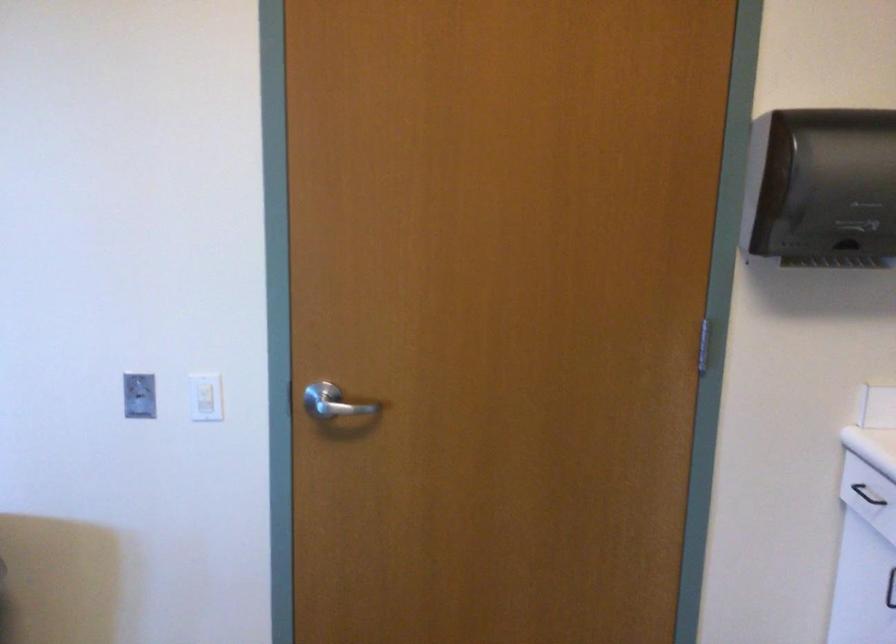
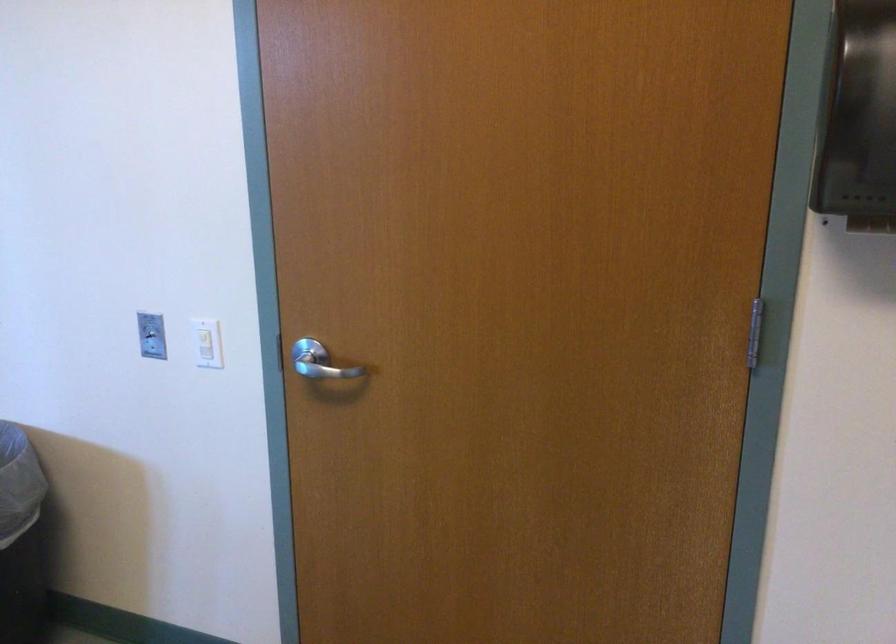
The images are taken continuously from a first-person perspective. In which direction are you moving?

The cameraman walked toward right, forward.